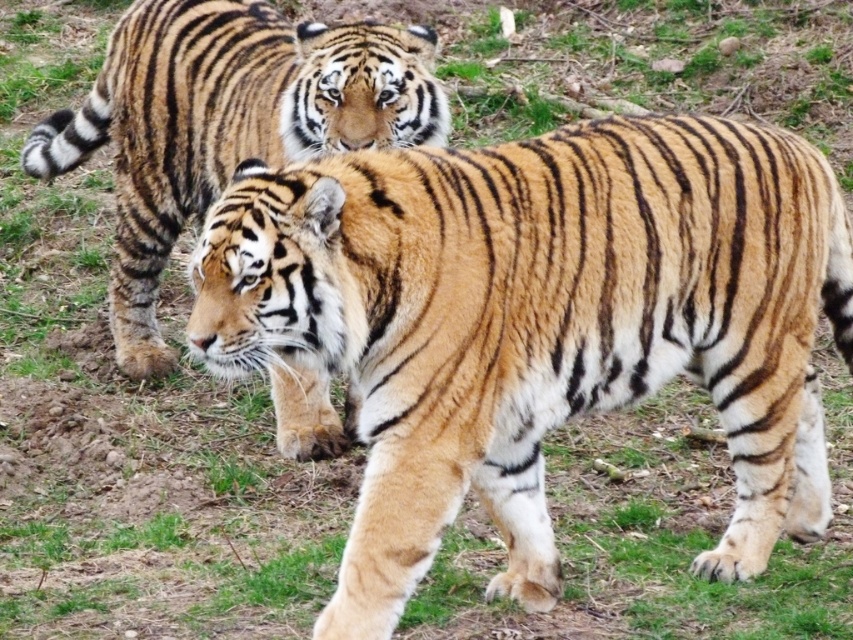
You are a wildlife photographer standing at the camera position. The golden fur tiger at center is your subject. You need to maintain a safe distance of at least 10 feet from the tiger for safety. Is your current position safe?

The golden fur tiger at center and camera are 9.50 feet apart, which is less than the required 10 feet safety distance. Therefore, your current position is not safe.